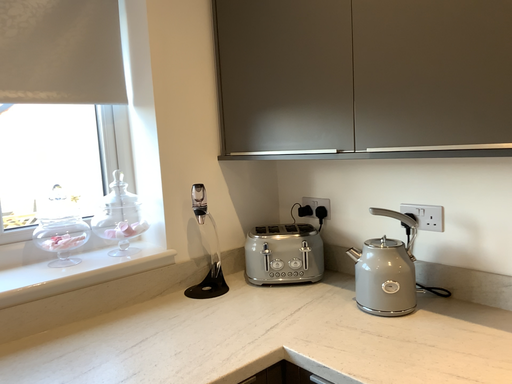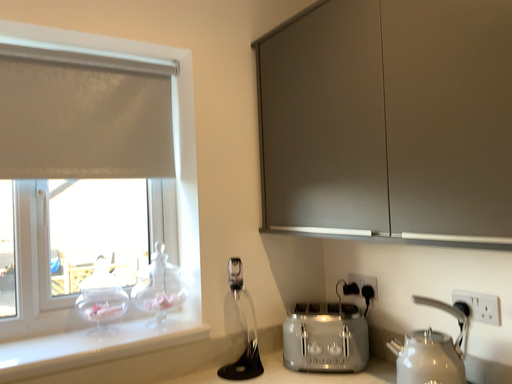
Question: Which way did the camera rotate in the video?

Choices:
 (A) rotated downward
 (B) rotated upward

Answer: (B)